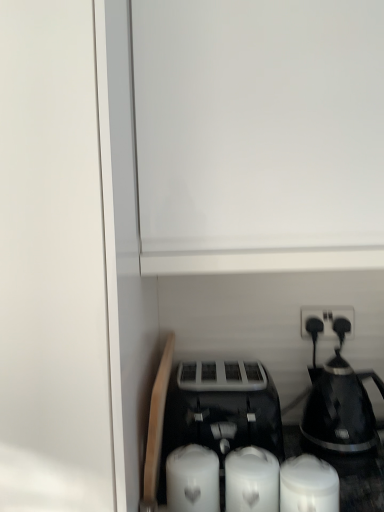
Question: Is point (198, 437) positioned closer to the camera than point (208, 464)?

Choices:
 (A) closer
 (B) farther

Answer: (B)

Question: Would you say black plastic toaster at center is inside or outside white matte candle at lower center, placed as the third candle when sorted from right to left?

Choices:
 (A) inside
 (B) outside

Answer: (B)

Question: Considering the real-world distances, which object is farthest from the white matte candle at lower right, which ranks as the third candle in left-to-right order?

Choices:
 (A) black plastic toaster at center
 (B) white matte candle at lower center, placed as the third candle when sorted from right to left
 (C) black plastic electric outlet at upper right
 (D) black glossy coffee maker at right
 (E) white matte candle at center, the second candle from the left

Answer: (C)

Question: Which is farther from the black plastic electric outlet at upper right?

Choices:
 (A) white matte candle at lower center, placed as the third candle when sorted from right to left
 (B) white matte candle at lower right, which ranks as the third candle in left-to-right order
 (C) black plastic toaster at center
 (D) white matte candle at center, which is the second candle from right to left
 (E) black glossy coffee maker at right

Answer: (A)